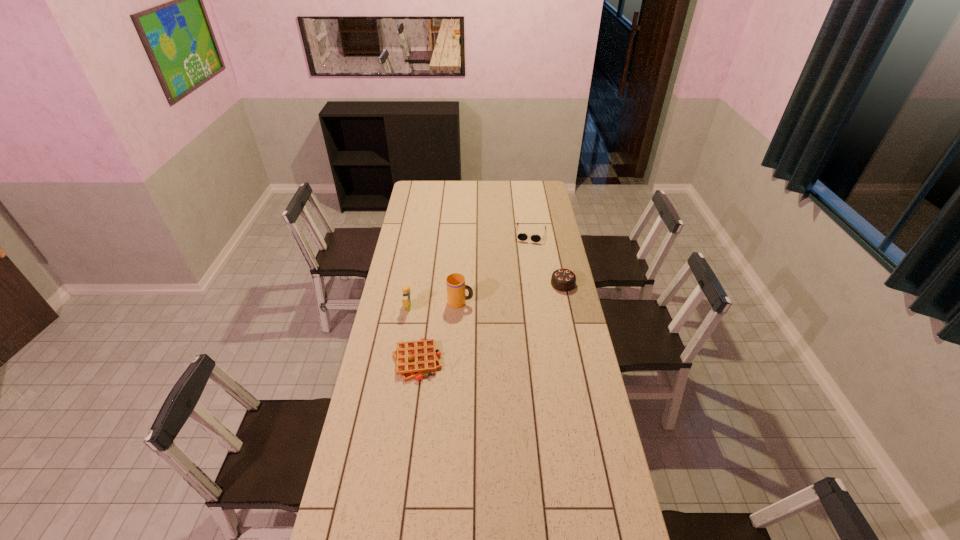
What are the coordinates of `the third closest object relative to the nearest object` in the screenshot? It's located at (563, 280).

Where is `vacant area that satisfies the following two spatial constraints: 1. on the back side of the chocolate cake; 2. on the left side of the Lego`? The height and width of the screenshot is (540, 960). vacant area that satisfies the following two spatial constraints: 1. on the back side of the chocolate cake; 2. on the left side of the Lego is located at coordinates (412, 284).

Image resolution: width=960 pixels, height=540 pixels. Find the location of `vacant space that satisfies the following two spatial constraints: 1. on the back side of the fourth tallest object; 2. on the right side of the third object from right to left`. vacant space that satisfies the following two spatial constraints: 1. on the back side of the fourth tallest object; 2. on the right side of the third object from right to left is located at coordinates (464, 234).

At what (x,y) coordinates should I click in order to perform the action: click on vacant position in the image that satisfies the following two spatial constraints: 1. on the front side of the third shortest object; 2. on the left side of the farthest object. Please return your answer as a coordinate pair (x, y). Looking at the image, I should click on (538, 284).

Where is `free space that satisfies the following two spatial constraints: 1. on the back side of the cup; 2. on the left side of the Lego`? free space that satisfies the following two spatial constraints: 1. on the back side of the cup; 2. on the left side of the Lego is located at coordinates (409, 302).

Where is `vacant space that satisfies the following two spatial constraints: 1. on the back side of the third object from left to right; 2. on the right side of the second farthest object`? The width and height of the screenshot is (960, 540). vacant space that satisfies the following two spatial constraints: 1. on the back side of the third object from left to right; 2. on the right side of the second farthest object is located at coordinates (462, 284).